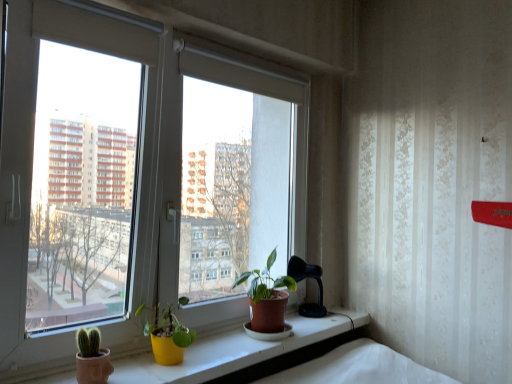
Find the location of `vacant space that is to the left of matte brown pot at center, positioned as the 1th houseplant in back-to-front order`. vacant space that is to the left of matte brown pot at center, positioned as the 1th houseplant in back-to-front order is located at coordinates (218, 340).